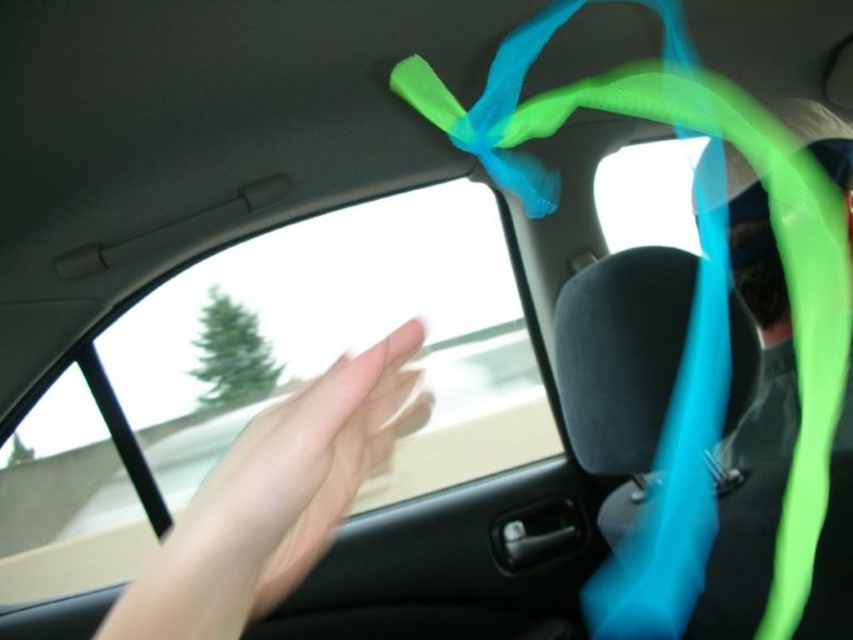
You are a passenger in a moving car and want to open the window further. The transparent glass car window at center is currently partially rolled down. Can you reach the window control button using the pale skin hand at center without moving your hand from its current position?

The transparent glass car window at center is positioned under the pale skin hand at center, so the hand can likely reach the window control button by moving downward since it is already above the window.

You are sitting in the passenger seat of a moving car. You want to reach out and touch the transparent glass car window at center. Based on your current position, can you comfortably reach it without stretching too much?

The transparent glass car window at center is located at point (343, 339), which is within a comfortable reaching distance from the passenger seat. Yes, you can comfortably reach it without stretching too much.